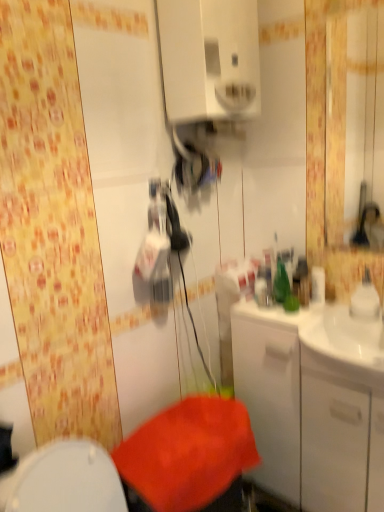
Question: Should I look upward or downward to see white glossy cabinet at right?

Choices:
 (A) down
 (B) up

Answer: (A)

Question: Is white glossy cabinet at right to the right of glossy plastic mirror at upper right from the viewer's perspective?

Choices:
 (A) yes
 (B) no

Answer: (B)

Question: Can you confirm if white glossy cabinet at right is smaller than glossy plastic mirror at upper right?

Choices:
 (A) no
 (B) yes

Answer: (A)

Question: From a real-world perspective, is white glossy cabinet at right under glossy plastic mirror at upper right?

Choices:
 (A) yes
 (B) no

Answer: (A)

Question: Is white glossy cabinet at right taller than glossy plastic mirror at upper right?

Choices:
 (A) no
 (B) yes

Answer: (B)

Question: Is glossy plastic mirror at upper right a part of white glossy cabinet at right?

Choices:
 (A) no
 (B) yes

Answer: (A)

Question: Considering the relative sizes of white glossy cabinet at right and glossy plastic mirror at upper right in the image provided, is white glossy cabinet at right shorter than glossy plastic mirror at upper right?

Choices:
 (A) yes
 (B) no

Answer: (B)

Question: Does glossy plastic mirror at upper right have a smaller size compared to white glossy medicine cabinet at upper center?

Choices:
 (A) no
 (B) yes

Answer: (B)

Question: Would you say white glossy medicine cabinet at upper center is part of glossy plastic mirror at upper right's contents?

Choices:
 (A) no
 (B) yes

Answer: (A)

Question: Is glossy plastic mirror at upper right to the left of white glossy medicine cabinet at upper center from the viewer's perspective?

Choices:
 (A) no
 (B) yes

Answer: (A)

Question: Is glossy plastic mirror at upper right taller than white glossy medicine cabinet at upper center?

Choices:
 (A) yes
 (B) no

Answer: (A)

Question: Does glossy plastic mirror at upper right come behind white glossy medicine cabinet at upper center?

Choices:
 (A) no
 (B) yes

Answer: (B)

Question: Does glossy plastic mirror at upper right have a larger size compared to white glossy medicine cabinet at upper center?

Choices:
 (A) yes
 (B) no

Answer: (B)

Question: Is white glossy medicine cabinet at upper center not close to glossy plastic mirror at upper right?

Choices:
 (A) no
 (B) yes

Answer: (B)